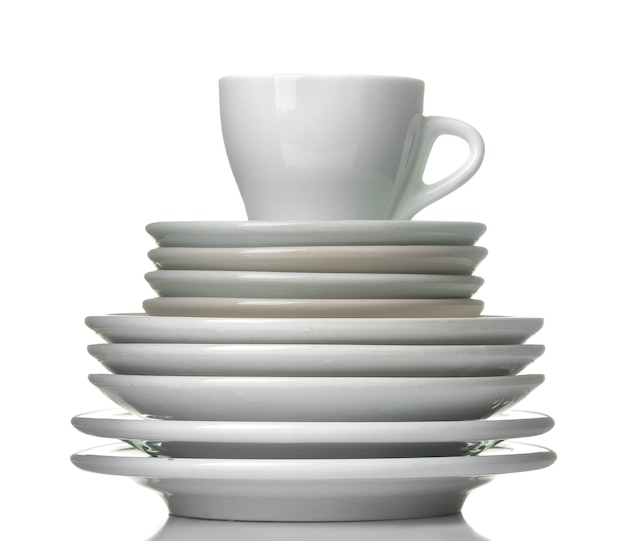
Locate an element on the screen. This screenshot has height=541, width=626. ceramic dishes is located at coordinates (329, 463), (325, 435), (326, 382), (329, 351), (325, 328), (317, 308), (329, 291), (327, 267), (326, 236), (337, 169).